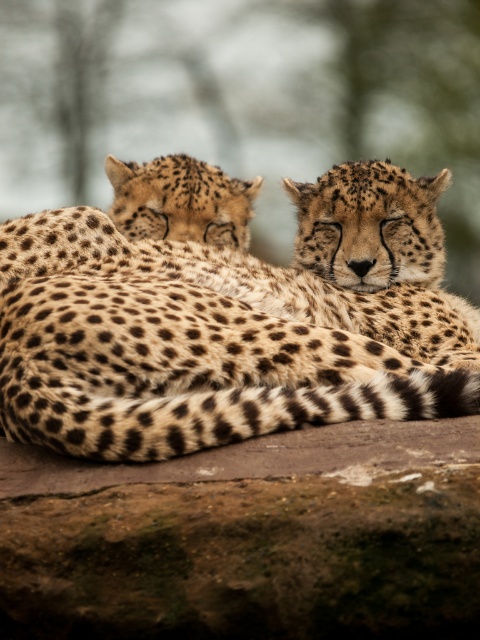
You are a wildlife photographer trying to capture a photo of the spotted fur cheetah at upper left. You notice the brown rough boulder at lower center might block your shot. Based on their positions, will the boulder interfere with your view of the cheetah?

The brown rough boulder at lower center is located below the spotted fur cheetah at upper left, so it will not block your view of the cheetah since it is positioned lower down.